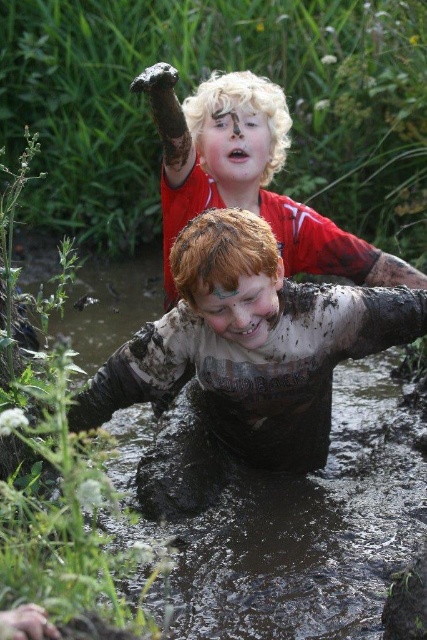
You are a parent trying to locate your children in the muddy scene. You see the muddy water at lower center and the muddy skin boy at center. Which object is closer to you?

The muddy water at lower center is closer to you since it is only 20.47 inches away from the muddy skin boy at center, indicating it is nearer in the scene.

Where is the muddy skin boy at center located in the image?

The muddy skin boy at center is located at point [251,342] in the image.